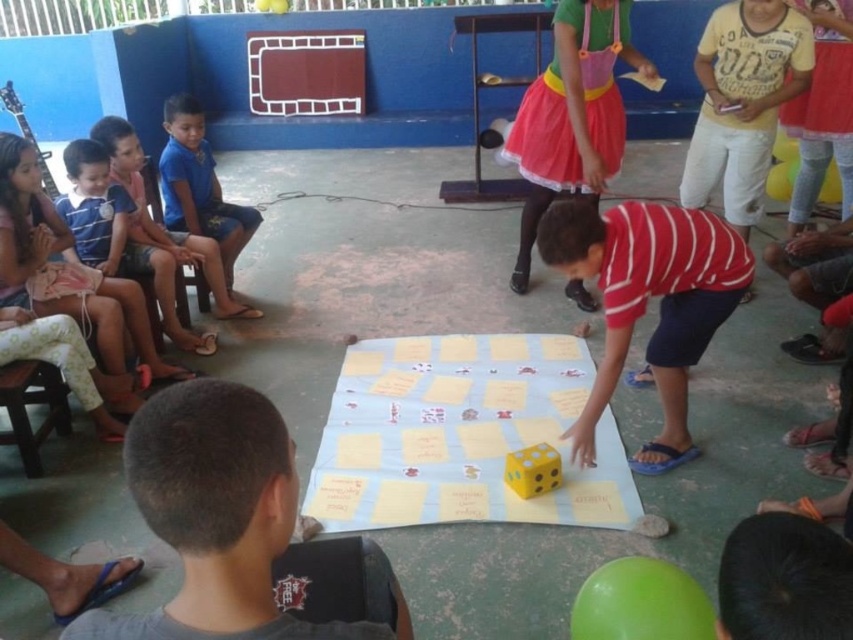
You are a child trying to reach the yellow matte dice at center from where the blue fabric shorts at left are. Can you comfortably stretch your hand to grab it without moving your feet?

The yellow matte dice at center and blue fabric shorts at left are 6.34 feet apart from each other. Since the average arm length of a child is about 2 feet, the distance is too far to reach without moving.